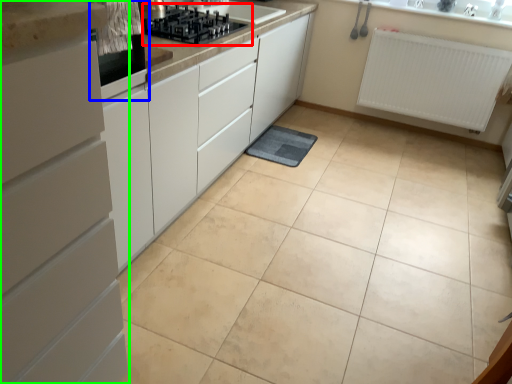
Question: Which object is the closest to the gas stove (highlighted by a red box)? Choose among these: home appliance (highlighted by a blue box) or cabinetry (highlighted by a green box).

Choices:
 (A) home appliance
 (B) cabinetry

Answer: (A)